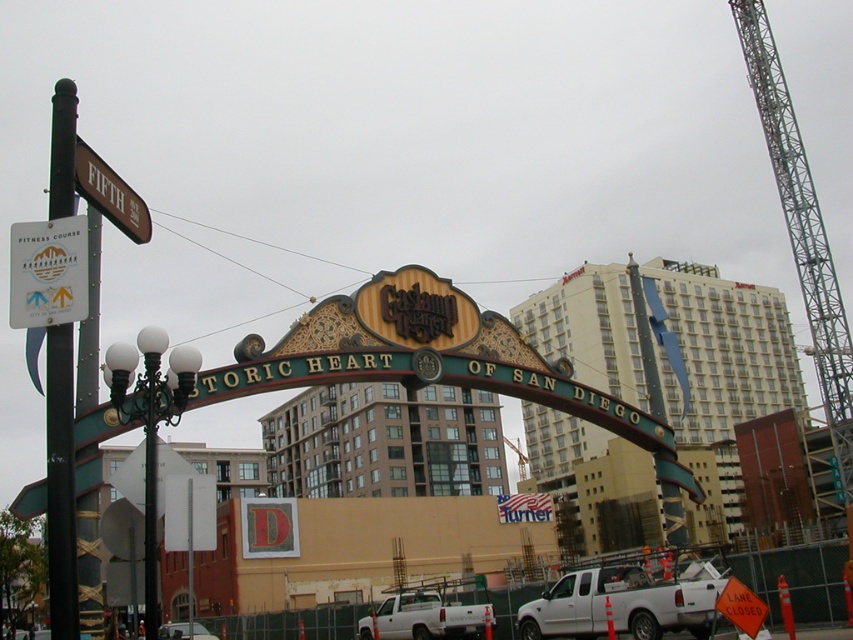
You are a delivery driver with a 10 feet wide truck. You need to park your vehicle between the white matte truck at center and the metallic silver car at center. The distance between them is 76.45 feet. Can your truck fit in this space without touching either vehicle?

The distance between the white matte truck at center and the metallic silver car at center is 76.45 feet. Since your truck is only 10 feet wide, there is more than enough space to park without touching either vehicle.

You are standing in front of the Historic Heart of San Diego archway. There is a point marked at coordinates [814,198]. If you want to reach that point quickly, should you walk towards the archway or away from it?

The point at [814,198] is 463.58 feet away from the viewer. Since the archway is in front of you, walking towards the archway will bring you closer to the point.